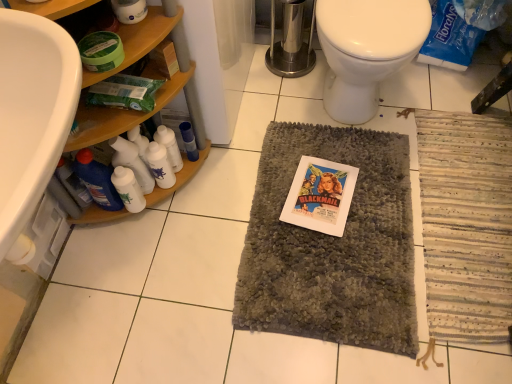
Locate an element on the screen. The width and height of the screenshot is (512, 384). free space in front of white glossy bottle at lower left, the 4th bottle viewed from the right is located at coordinates (137, 256).